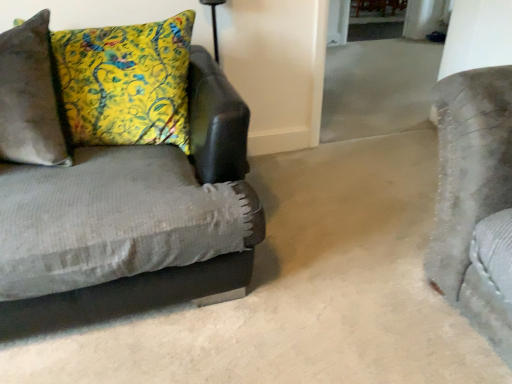
This screenshot has height=384, width=512. Describe the element at coordinates (126, 82) in the screenshot. I see `yellow floral pillow at left` at that location.

Where is `yellow floral pillow at left`? The image size is (512, 384). yellow floral pillow at left is located at coordinates (126, 82).

Locate an element on the screen. This screenshot has width=512, height=384. velvet gray couch at left is located at coordinates (132, 221).

This screenshot has width=512, height=384. Describe the element at coordinates (132, 221) in the screenshot. I see `velvet gray couch at left` at that location.

I want to click on yellow floral pillow at left, so click(x=126, y=82).

Considering the relative positions of velvet gray couch at left and yellow floral pillow at left in the image provided, is velvet gray couch at left to the right of yellow floral pillow at left from the viewer's perspective?

Yes.

Considering the positions of objects velvet gray couch at left and yellow floral pillow at left in the image provided, who is in front, velvet gray couch at left or yellow floral pillow at left?

velvet gray couch at left is closer to the camera.

Is point (0, 299) positioned after point (91, 105)?

That is False.

From the image's perspective, which object appears higher, velvet gray couch at left or yellow floral pillow at left?

yellow floral pillow at left appears higher in the image.

Consider the image. From a real-world perspective, is velvet gray couch at left beneath yellow floral pillow at left?

Yes.

Considering the sizes of objects velvet gray couch at left and yellow floral pillow at left in the image provided, who is thinner, velvet gray couch at left or yellow floral pillow at left?

With smaller width is yellow floral pillow at left.

Considering the sizes of objects velvet gray couch at left and yellow floral pillow at left in the image provided, who is shorter, velvet gray couch at left or yellow floral pillow at left?

yellow floral pillow at left.

Considering the sizes of objects velvet gray couch at left and yellow floral pillow at left in the image provided, who is smaller, velvet gray couch at left or yellow floral pillow at left?

With smaller size is yellow floral pillow at left.

Is velvet gray couch at left located outside yellow floral pillow at left?

Yes, velvet gray couch at left is not within yellow floral pillow at left.

Are velvet gray couch at left and yellow floral pillow at left located far from each other?

velvet gray couch at left is near yellow floral pillow at left, not far away.

Is yellow floral pillow at left at the back of velvet gray couch at left?

That's right, velvet gray couch at left is facing away from yellow floral pillow at left.

Looking at this image, how different are the orientations of velvet gray couch at left and yellow floral pillow at left in degrees?

The angular difference between velvet gray couch at left and yellow floral pillow at left is 15.8 degrees.

Measure the distance between velvet gray couch at left and yellow floral pillow at left.

velvet gray couch at left and yellow floral pillow at left are 11.05 inches apart from each other.

In the image, there is a yellow floral pillow at left. At what (x,y) coordinates should I click in order to perform the action: click on studio couch below it (from a real-world perspective). Please return your answer as a coordinate pair (x, y). Looking at the image, I should click on (132, 221).

Can you confirm if yellow floral pillow at left is positioned to the left of velvet gray couch at left?

Yes, yellow floral pillow at left is to the left of velvet gray couch at left.

Is yellow floral pillow at left further to camera compared to velvet gray couch at left?

That is True.

Is point (78, 63) positioned before point (42, 180)?

No, it is not.

From the image's perspective, is yellow floral pillow at left under velvet gray couch at left?

No.

From a real-world perspective, is yellow floral pillow at left positioned above or below velvet gray couch at left?

yellow floral pillow at left is above velvet gray couch at left.

Looking at their sizes, would you say yellow floral pillow at left is wider or thinner than velvet gray couch at left?

Clearly, yellow floral pillow at left has less width compared to velvet gray couch at left.

Based on the photo, considering the relative sizes of yellow floral pillow at left and velvet gray couch at left in the image provided, is yellow floral pillow at left shorter than velvet gray couch at left?

Indeed, yellow floral pillow at left has a lesser height compared to velvet gray couch at left.

Looking at the image, does yellow floral pillow at left seem bigger or smaller compared to velvet gray couch at left?

Considering their sizes, yellow floral pillow at left takes up less space than velvet gray couch at left.

Does yellow floral pillow at left contain velvet gray couch at left?

No, yellow floral pillow at left does not contain velvet gray couch at left.

Is yellow floral pillow at left beside velvet gray couch at left?

No.

Is velvet gray couch at left at the back of yellow floral pillow at left?

Yes, yellow floral pillow at left's orientation is away from velvet gray couch at left.

At what (x,y) coordinates should I click in order to perform the action: click on pillow above the velvet gray couch at left (from a real-world perspective). Please return your answer as a coordinate pair (x, y). This screenshot has width=512, height=384. Looking at the image, I should click on (126, 82).

Identify the location of pillow lying behind the velvet gray couch at left. (126, 82).

Find the location of a particular element. The image size is (512, 384). studio couch below the yellow floral pillow at left (from the image's perspective) is located at coordinates (132, 221).